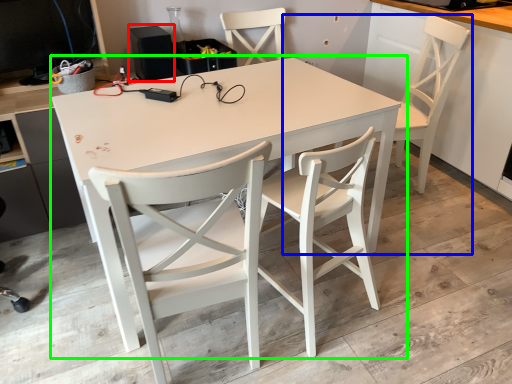
Question: Which object is the farthest from speaker (highlighted by a red box)? Choose among these: chair (highlighted by a blue box) or table (highlighted by a green box).

Choices:
 (A) chair
 (B) table

Answer: (A)